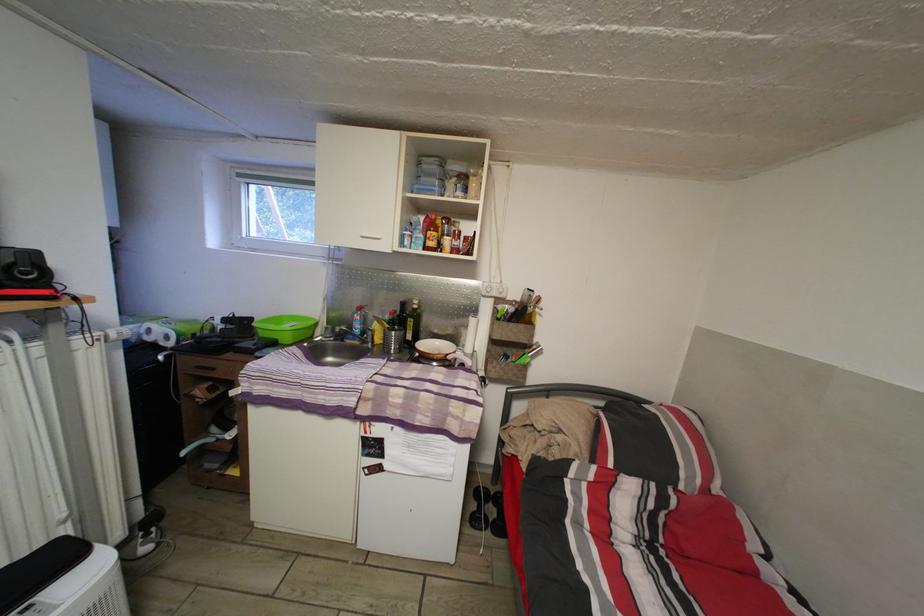
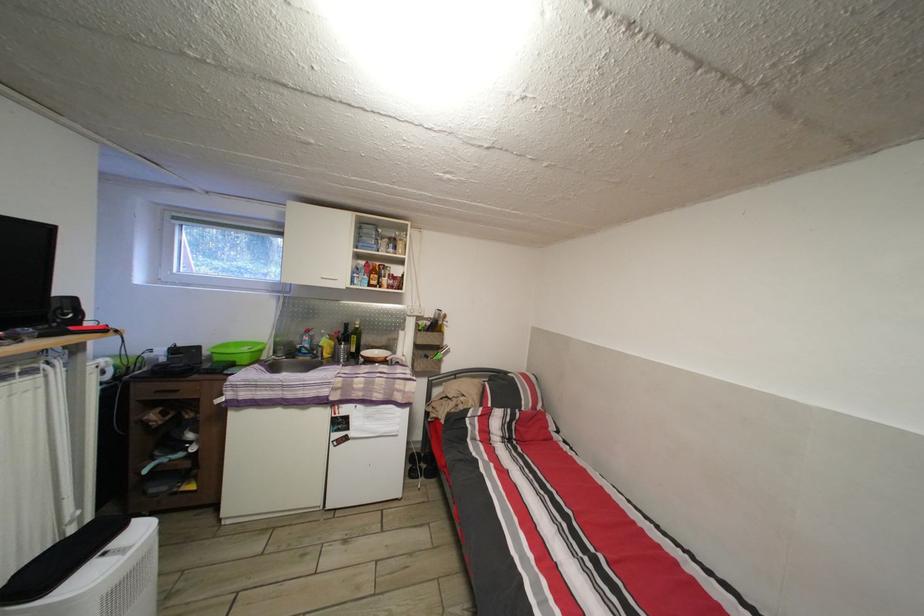
Question: I am providing you with two images of the same scene from different viewpoints. Which of the following objects are not visible in image2?

Choices:
 (A) yellow plastic bottle
 (B) small white bowl
 (C) green plastic bowl
 (D) none of these

Answer: (D)